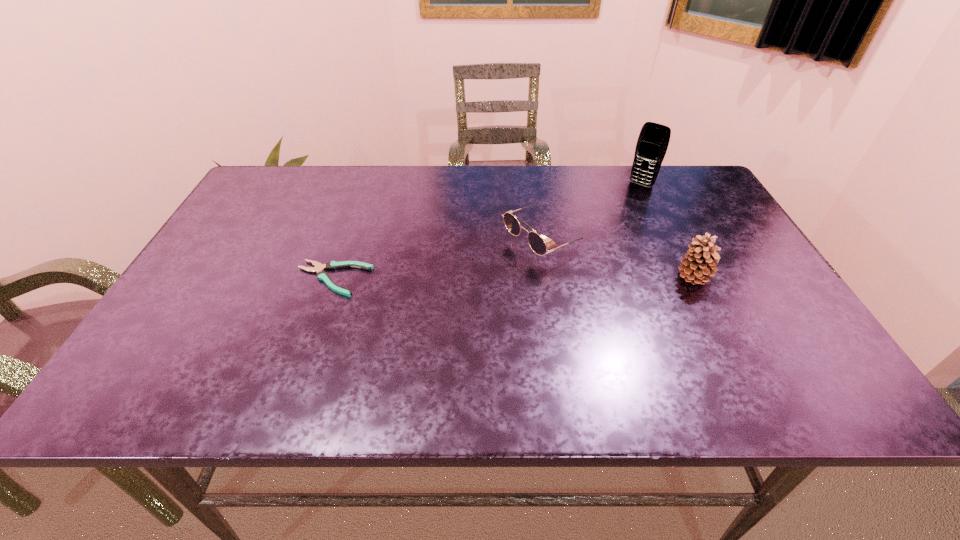
Where is `vacant area that lies between the shortest object and the pinecone`? vacant area that lies between the shortest object and the pinecone is located at coordinates (514, 278).

At what (x,y) coordinates should I click in order to perform the action: click on free space between the cellular telephone and the second shortest object. Please return your answer as a coordinate pair (x, y). The height and width of the screenshot is (540, 960). Looking at the image, I should click on (593, 212).

I want to click on free area in between the pinecone and the third object from right to left, so click(619, 259).

The image size is (960, 540). I want to click on vacant area between the farthest object and the shortest object, so click(x=487, y=232).

Locate an element on the screen. free area in between the shortest object and the sunglasses is located at coordinates (439, 259).

At what (x,y) coordinates should I click in order to perform the action: click on vacant space that is in between the second object from left to right and the farthest object. Please return your answer as a coordinate pair (x, y). Looking at the image, I should click on (593, 212).

Choose which object is the third nearest neighbor to the pinecone. Please provide its 2D coordinates. Your answer should be formatted as a tuple, i.e. [(x, y)], where the tuple contains the x and y coordinates of a point satisfying the conditions above.

[(319, 268)]

Identify which object is the second closest to the tallest object. Please provide its 2D coordinates. Your answer should be formatted as a tuple, i.e. [(x, y)], where the tuple contains the x and y coordinates of a point satisfying the conditions above.

[(700, 260)]

Where is `free location that satisfies the following two spatial constraints: 1. on the front side of the sunglasses; 2. on the right side of the third shortest object`? The image size is (960, 540). free location that satisfies the following two spatial constraints: 1. on the front side of the sunglasses; 2. on the right side of the third shortest object is located at coordinates click(x=551, y=278).

This screenshot has height=540, width=960. Identify the location of vacant space that satisfies the following two spatial constraints: 1. on the back side of the shortest object; 2. on the right side of the farthest object. (365, 185).